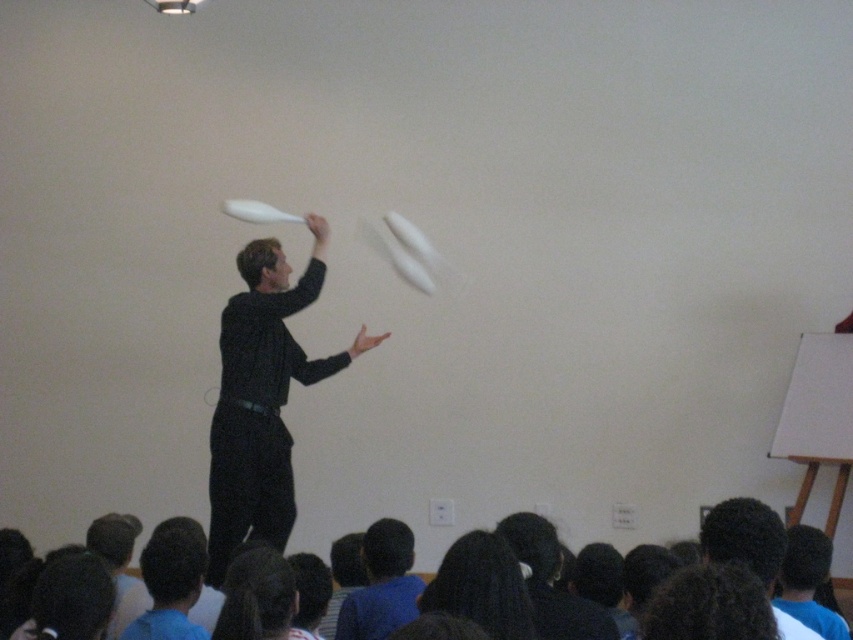
Question: Can you confirm if black matte shirt at center is positioned to the right of dark brown hair at lower right?

Choices:
 (A) yes
 (B) no

Answer: (B)

Question: Among these objects, which one is nearest to the camera?

Choices:
 (A) smooth black shirt at center
 (B) dark brown hair at lower right

Answer: (B)

Question: Among these points, which one is farthest from the camera?

Choices:
 (A) [x=314, y=365]
 (B) [x=722, y=536]
 (C) [x=393, y=616]
 (D) [x=422, y=605]

Answer: (A)

Question: Does black matte shirt at center come behind dark hair at lower center?

Choices:
 (A) no
 (B) yes

Answer: (B)

Question: Which object is the closest to the black matte shirt at center?

Choices:
 (A) dark brown hair at lower right
 (B) dark hair at lower center

Answer: (B)

Question: Does black matte shirt at center appear under dark hair at lower center?

Choices:
 (A) no
 (B) yes

Answer: (A)